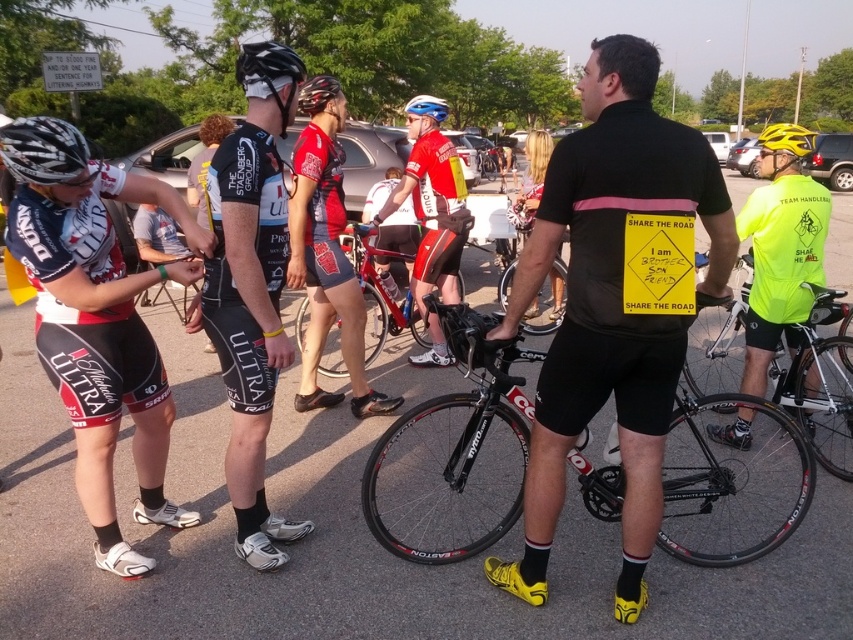
You are a photographer trying to capture a clear shot of both the black matte jersey at center and the black matte helmet at upper center. Since both are black and matte, you want to adjust your camera settings to ensure they are distinguishable. Considering their sizes, which object should you focus on first to ensure it doesn

The black matte jersey at center has a smaller size compared to the black matte helmet at upper center. Therefore, you should focus on the black matte jersey at center first because smaller objects often require more precise focus to capture details clearly.

You are a photographer trying to capture a shot of the black matte jersey at center and the black matte helmet at upper center. Which object should you zoom in on to ensure both are in focus without moving your camera position? Explain your reasoning based on their sizes in the image.

The black matte jersey at center has a lesser width compared to the black matte helmet at upper center. To keep both in focus, you should zoom in on the larger object, the black matte helmet at upper center, as it requires less adjustment to frame both effectively.